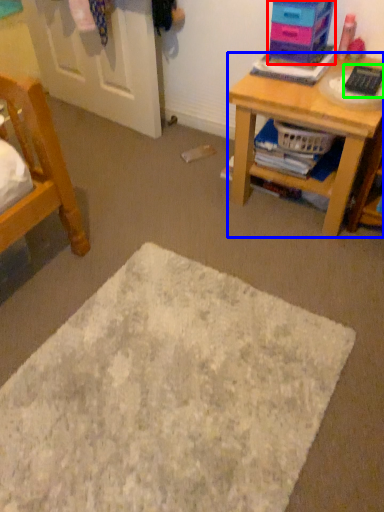
Question: Based on their relative distances, which object is nearer to shelf (highlighted by a red box)? Choose from desk (highlighted by a blue box) and remote control (highlighted by a green box).

Choices:
 (A) desk
 (B) remote control

Answer: (B)